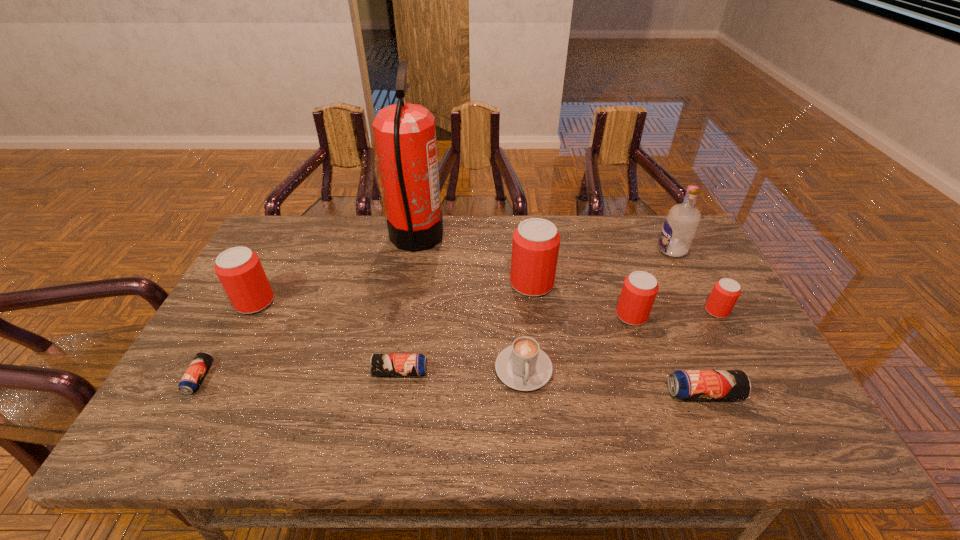
Where is `the fifth closest beer can to the cappuccino`? the fifth closest beer can to the cappuccino is located at coordinates (725, 293).

Identify the location of red beer can identified as the second closest to the second smallest blue beer can. (239, 269).

Point out which red beer can is positioned as the fourth nearest to the tallest object. Please provide its 2D coordinates. Your answer should be formatted as a tuple, i.e. [(x, y)], where the tuple contains the x and y coordinates of a point satisfying the conditions above.

[(725, 293)]

I want to click on blue beer can object that ranks as the closest to the third smallest red beer can, so 189,383.

Locate an element on the screen. This screenshot has height=540, width=960. blue beer can that can be found as the closest to the second red beer can from left to right is located at coordinates (380, 364).

Where is `blank area in the image that satisfies the following two spatial constraints: 1. on the front side of the smallest red beer can; 2. on the left side of the second red beer can from left to right`? blank area in the image that satisfies the following two spatial constraints: 1. on the front side of the smallest red beer can; 2. on the left side of the second red beer can from left to right is located at coordinates coord(536,311).

At what (x,y) coordinates should I click in order to perform the action: click on free spot that satisfies the following two spatial constraints: 1. on the front side of the black fire extinguisher; 2. on the back side of the fifth tallest object. Please return your answer as a coordinate pair (x, y). The width and height of the screenshot is (960, 540). Looking at the image, I should click on (403, 315).

I want to click on free region that satisfies the following two spatial constraints: 1. on the front side of the fire extinguisher; 2. on the left side of the biggest blue beer can, so click(389, 393).

Where is `vacant space that satisfies the following two spatial constraints: 1. on the front side of the third tallest object; 2. on the right side of the black fire extinguisher`? The image size is (960, 540). vacant space that satisfies the following two spatial constraints: 1. on the front side of the third tallest object; 2. on the right side of the black fire extinguisher is located at coordinates (409, 284).